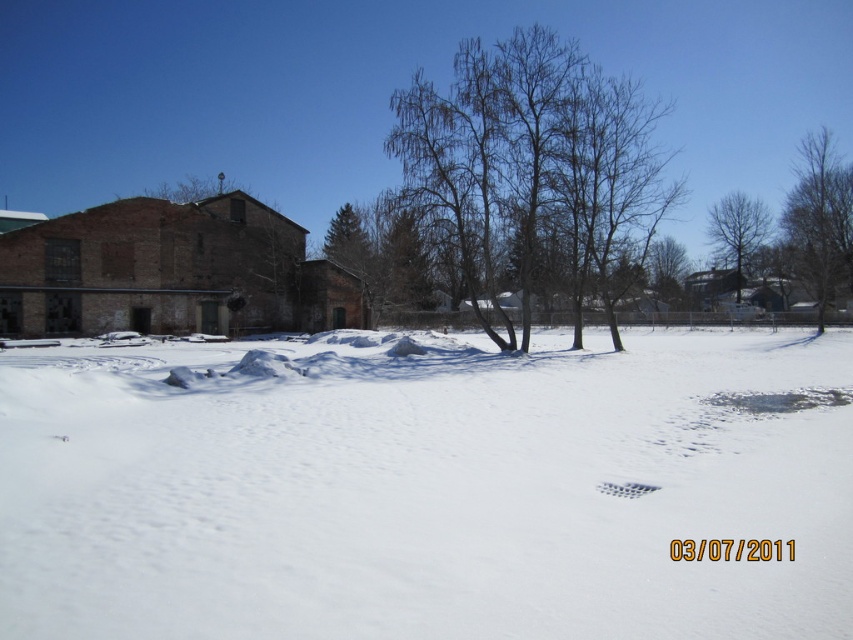
You are standing at the origin point in the snowy landscape. There are two points marked in the image, point A at coordinates point A is point (427, 262) and point B at point B is point (637, 497). Which point is closer to you?

Point B at point (637, 497) is closer to you because point A at point (427, 262) is behind it.

You are standing at the bottom left corner of the snowy landscape. You see two points marked in the image. The first point is at coordinates point (x=416, y=276) and the second is at point (x=711, y=230). If you want to walk towards the point that is closer to you, which point should you head towards?

Point (x=416, y=276) is in front of point (x=711, y=230), so you should head towards point (x=416, y=276) as it is closer to your current position at the bottom left corner.

You are a snowplow operator trying to clear the white plastic footprint at center. You see the brown textured tree at center in your way. Can you reach the footprint without moving the tree?

The white plastic footprint at center is behind the brown textured tree at center, so you cannot reach it without moving the tree.